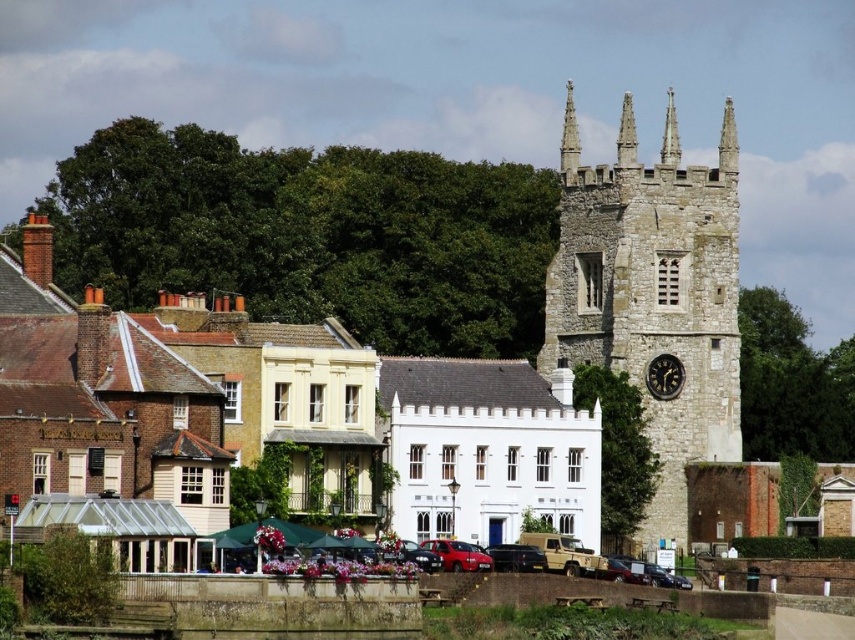
Question: Which point is farther to the camera?

Choices:
 (A) stone clock tower at center
 (B) metallic red car at center
 (C) black stone clock at right

Answer: (C)

Question: Does stone clock tower at center appear on the right side of black stone clock at right?

Choices:
 (A) no
 (B) yes

Answer: (B)

Question: Observing the image, what is the correct spatial positioning of metallic red car at center in reference to black stone clock at right?

Choices:
 (A) below
 (B) above

Answer: (A)

Question: Which object is positioned closest to the black stone clock at right?

Choices:
 (A) metallic red car at center
 (B) stone clock tower at center

Answer: (B)

Question: Where is metallic red car at center located in relation to black stone clock at right in the image?

Choices:
 (A) below
 (B) above

Answer: (A)

Question: Which object is closer to the camera taking this photo?

Choices:
 (A) metallic red car at center
 (B) stone clock tower at center
 (C) black stone clock at right

Answer: (A)